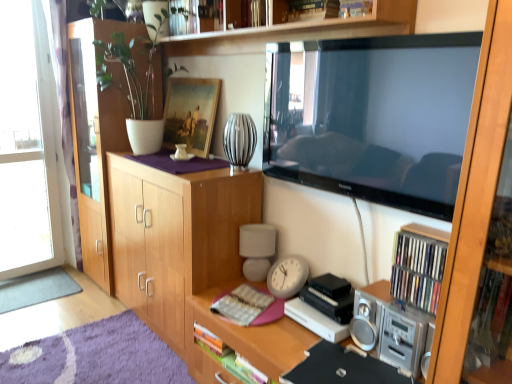
Question: Does white ceramic vase at upper left turn towards white matte lamp at center?

Choices:
 (A) no
 (B) yes

Answer: (A)

Question: Is the depth of white ceramic vase at upper left greater than that of white matte lamp at center?

Choices:
 (A) no
 (B) yes

Answer: (A)

Question: Is white ceramic vase at upper left located outside white matte lamp at center?

Choices:
 (A) no
 (B) yes

Answer: (B)

Question: Can you confirm if white ceramic vase at upper left is positioned to the left of white matte lamp at center?

Choices:
 (A) no
 (B) yes

Answer: (B)

Question: Can you confirm if white ceramic vase at upper left is thinner than white matte lamp at center?

Choices:
 (A) yes
 (B) no

Answer: (B)

Question: Considering their positions, is wooden picture frame at upper center located in front of or behind hardcover book at center?

Choices:
 (A) front
 (B) behind

Answer: (B)

Question: From the image's perspective, is wooden picture frame at upper center above or below hardcover book at center?

Choices:
 (A) above
 (B) below

Answer: (A)

Question: Considering the relative positions of wooden picture frame at upper center and hardcover book at center in the image provided, is wooden picture frame at upper center to the left or to the right of hardcover book at center?

Choices:
 (A) left
 (B) right

Answer: (A)

Question: Is wooden picture frame at upper center inside or outside of hardcover book at center?

Choices:
 (A) outside
 (B) inside

Answer: (A)

Question: Considering the positions of gray carpet at lower left and hardcover book at center in the image, is gray carpet at lower left wider or thinner than hardcover book at center?

Choices:
 (A) wide
 (B) thin

Answer: (A)

Question: From a real-world perspective, relative to hardcover book at center, is gray carpet at lower left vertically above or below?

Choices:
 (A) below
 (B) above

Answer: (A)

Question: From their relative heights in the image, would you say gray carpet at lower left is taller or shorter than hardcover book at center?

Choices:
 (A) tall
 (B) short

Answer: (B)

Question: Is gray carpet at lower left to the left or to the right of hardcover book at center in the image?

Choices:
 (A) left
 (B) right

Answer: (A)

Question: Considering their positions, is hardcover book at center located in front of or behind gray carpet at lower left?

Choices:
 (A) front
 (B) behind

Answer: (A)

Question: From a real-world perspective, is hardcover book at center positioned above or below gray carpet at lower left?

Choices:
 (A) above
 (B) below

Answer: (A)